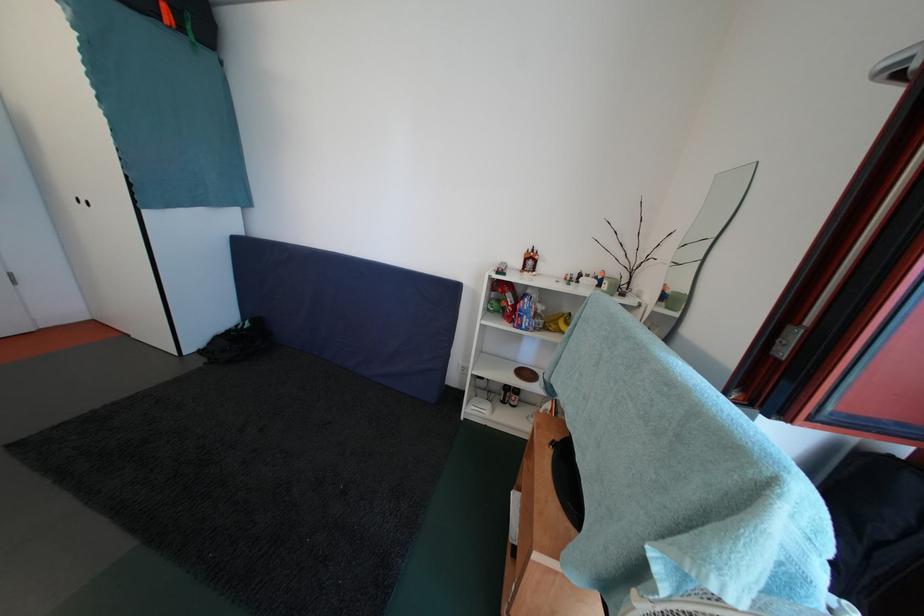
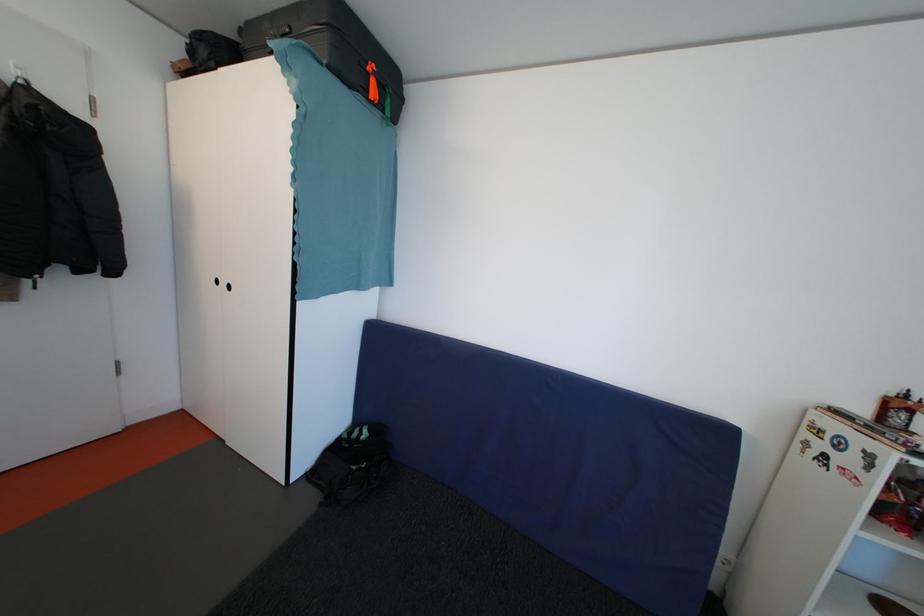
In a continuous first-person perspective shot, in which direction is the camera moving?

The cameraman walked toward left, forward.